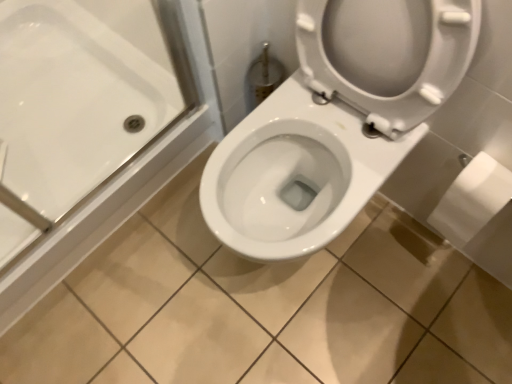
Question: Is white matte toilet paper at right behind white glossy bathtub at upper left?

Choices:
 (A) yes
 (B) no

Answer: (A)

Question: Does white matte toilet paper at right have a greater height compared to white glossy bathtub at upper left?

Choices:
 (A) no
 (B) yes

Answer: (A)

Question: Is there a large distance between white matte toilet paper at right and white glossy bathtub at upper left?

Choices:
 (A) yes
 (B) no

Answer: (A)

Question: Does white matte toilet paper at right appear on the left side of white glossy bathtub at upper left?

Choices:
 (A) yes
 (B) no

Answer: (B)

Question: Is white matte toilet paper at right looking in the opposite direction of white glossy bathtub at upper left?

Choices:
 (A) no
 (B) yes

Answer: (A)

Question: From a real-world perspective, is white matte toilet paper at right above or below white glossy toilet at center?

Choices:
 (A) above
 (B) below

Answer: (B)

Question: Considering the positions of point (473, 162) and point (438, 59), is point (473, 162) closer or farther from the camera than point (438, 59)?

Choices:
 (A) closer
 (B) farther

Answer: (B)

Question: Based on their sizes in the image, would you say white matte toilet paper at right is bigger or smaller than white glossy toilet at center?

Choices:
 (A) big
 (B) small

Answer: (B)

Question: In terms of width, does white matte toilet paper at right look wider or thinner when compared to white glossy toilet at center?

Choices:
 (A) wide
 (B) thin

Answer: (B)

Question: Does point (473, 49) appear closer or farther from the camera than point (13, 81)?

Choices:
 (A) closer
 (B) farther

Answer: (A)

Question: Looking at their shapes, would you say white glossy toilet at center is wider or thinner than white glossy bathtub at upper left?

Choices:
 (A) thin
 (B) wide

Answer: (B)

Question: Is white glossy toilet at center in front of or behind white glossy bathtub at upper left in the image?

Choices:
 (A) front
 (B) behind

Answer: (A)

Question: Visually, is white glossy toilet at center positioned to the left or to the right of white glossy bathtub at upper left?

Choices:
 (A) right
 (B) left

Answer: (A)

Question: From the image's perspective, relative to white matte toilet paper at right, is white glossy bathtub at upper left above or below?

Choices:
 (A) above
 (B) below

Answer: (A)

Question: From a real-world perspective, is white glossy bathtub at upper left positioned above or below white matte toilet paper at right?

Choices:
 (A) below
 (B) above

Answer: (B)